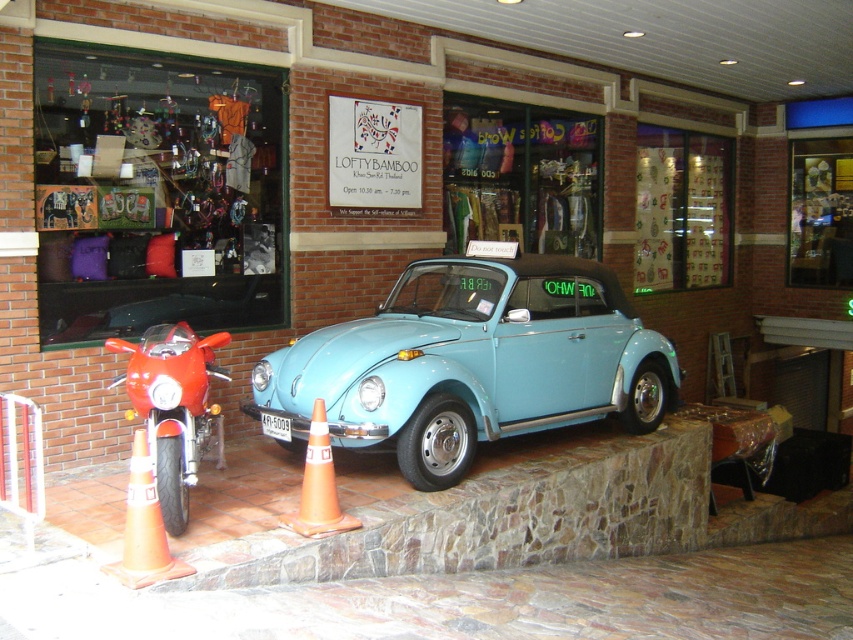
Does light blue matte car at center lie behind musical note wallpaper at upper right?

No.

Who is positioned more to the right, light blue matte car at center or musical note wallpaper at upper right?

Positioned to the right is musical note wallpaper at upper right.

At what (x,y) coordinates should I click in order to perform the action: click on light blue matte car at center. Please return your answer as a coordinate pair (x, y). This screenshot has height=640, width=853. Looking at the image, I should click on (473, 362).

Identify the location of light blue matte car at center. The width and height of the screenshot is (853, 640). (473, 362).

Who is shorter, shiny red motorcycle at left or orange plastic traffic cone at lower left?

orange plastic traffic cone at lower left

Which is more to the right, shiny red motorcycle at left or orange plastic traffic cone at lower left?

orange plastic traffic cone at lower left is more to the right.

This screenshot has height=640, width=853. Identify the location of shiny red motorcycle at left. (172, 406).

Is shiny red motorcycle at left thinner than white plastic license plate at center?

Incorrect, shiny red motorcycle at left's width is not less than white plastic license plate at center's.

Does point (164, 365) come closer to viewer compared to point (279, 417)?

Yes, point (164, 365) is closer to viewer.

The width and height of the screenshot is (853, 640). In order to click on shiny red motorcycle at left in this screenshot , I will do `click(172, 406)`.